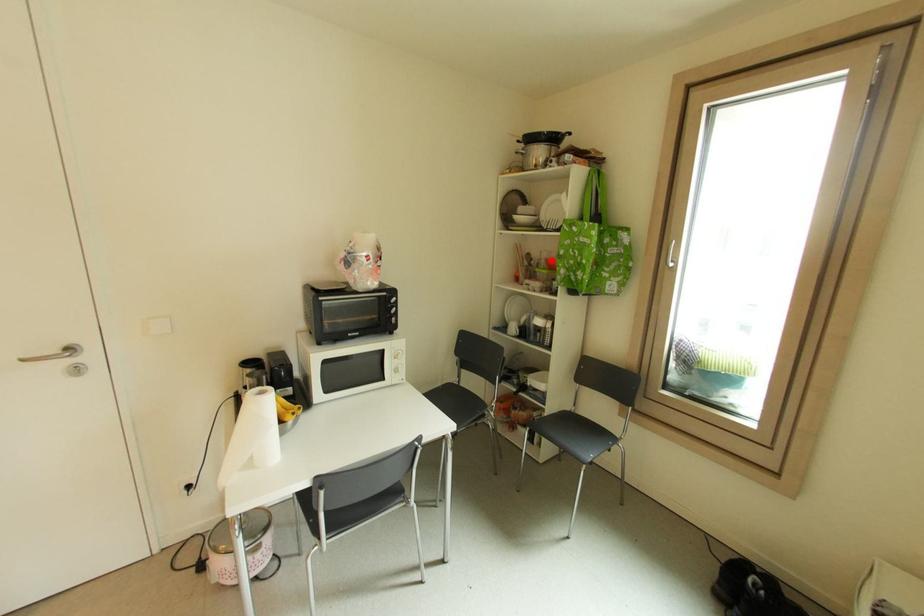
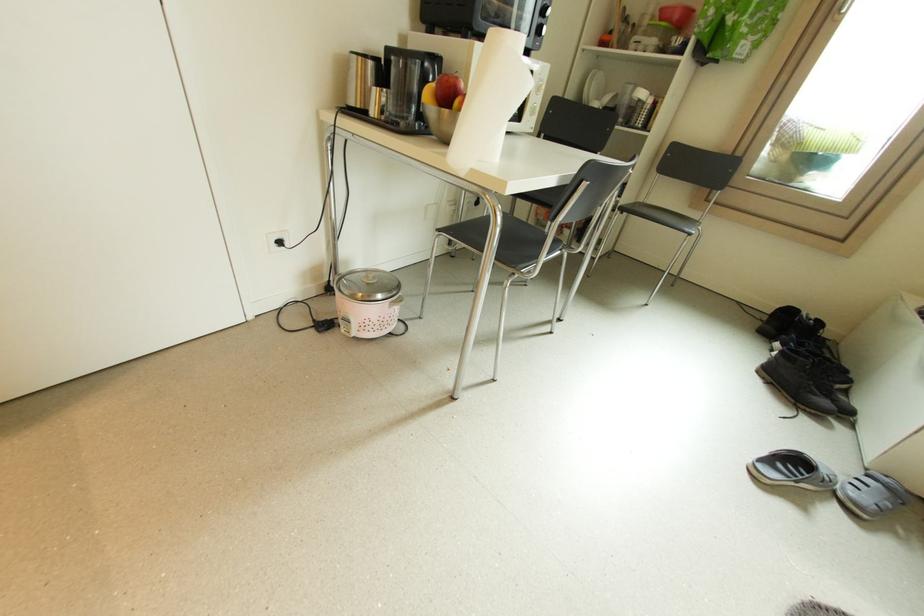
Locate, in the second image, the point that corresponds to the highlighted location in the first image.

(666, 10)